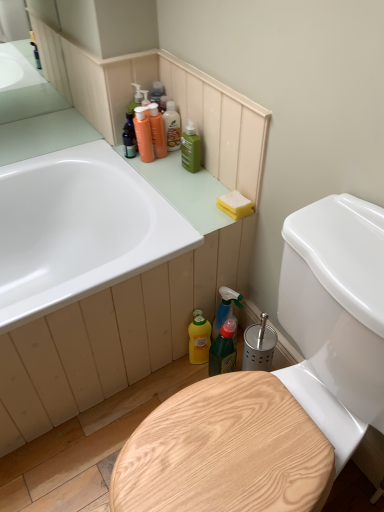
Question: Choose the correct answer: Is green plastic spray bottle at lower center inside translucent green spray bottle at lower right, which ranks as the 5th cleaning product in top-to-bottom order, or outside it?

Choices:
 (A) outside
 (B) inside

Answer: (A)

Question: From their relative heights in the image, would you say green plastic spray bottle at lower center is taller or shorter than translucent green spray bottle at lower right, which ranks as the 5th cleaning product in top-to-bottom order?

Choices:
 (A) short
 (B) tall

Answer: (A)

Question: Based on their relative distances, which object is nearer to the green matte bottle at upper center, which is the third cleaning product from bottom to top?

Choices:
 (A) yellow matte bottle at lower center, the first cleaning product when ordered from bottom to top
 (B) translucent orange bottle at upper center, arranged as the fifth cleaning product when ordered from the bottom
 (C) translucent amber bottle at upper center, the first cleaning product from the top
 (D) yellow sponge at upper right
 (E) matte orange bottles at upper left, marked as the 4th cleaning product in a bottom-to-top arrangement

Answer: (C)

Question: Based on their relative distances, which object is farther from the wooden at lower right?

Choices:
 (A) yellow matte bottle at lower center, the first cleaning product when ordered from bottom to top
 (B) green plastic spray bottle at lower center
 (C) matte orange bottles at upper left, marked as the 4th cleaning product in a bottom-to-top arrangement
 (D) translucent green spray bottle at lower right, which appears as the 2th cleaning product when ordered from the bottom
 (E) yellow sponge at upper right

Answer: (C)